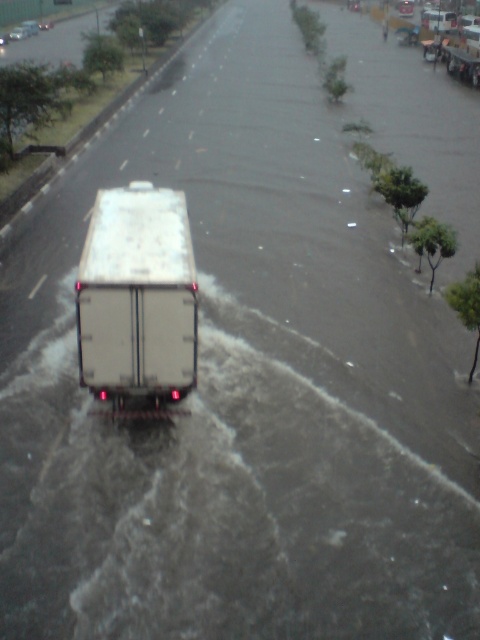
You are a delivery driver observing the flooded street scene. You need to determine the position of the white matte trailer truck at center relative to the white matte truck at center. According to the scene, which one is lower in the image?

The white matte trailer truck at center is located below the white matte truck at center, so it is lower in the image.

You are a delivery driver who needs to navigate through the flooded street. You see a white matte trailer truck at center and a white matte truck at center. Which vehicle has a narrower width to pass through a narrow bridge ahead?

The white matte trailer truck at center is thinner than the white matte truck at center, so it can pass through the narrow bridge more easily.